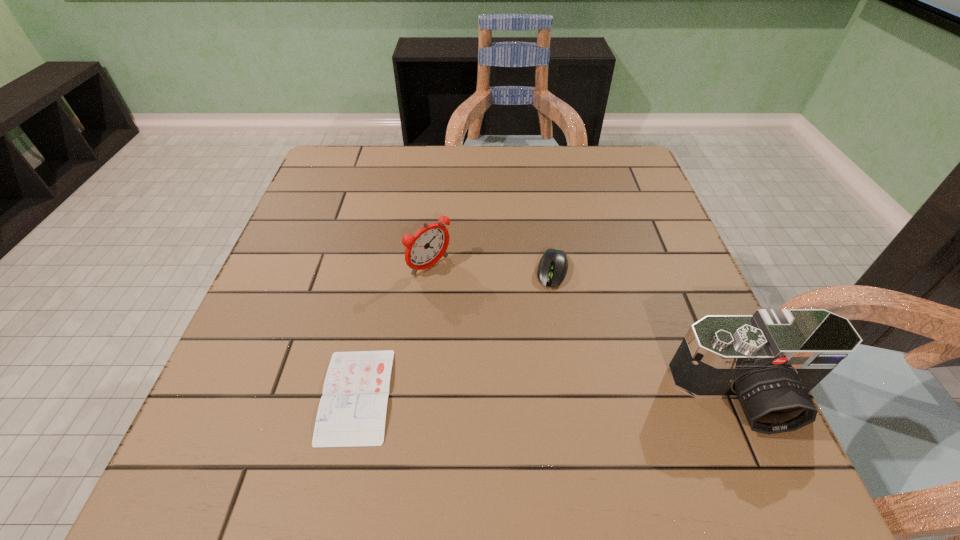
Image resolution: width=960 pixels, height=540 pixels. What are the coordinates of `diary` in the screenshot? It's located at (352, 411).

You are a GUI agent. You are given a task and a screenshot of the screen. Output one action in this format:
    pyautogui.click(x=<x>, y=<y>)
    Task: Click on the rightmost object
    The height and width of the screenshot is (540, 960).
    Given the screenshot: What is the action you would take?
    pyautogui.click(x=771, y=360)

This screenshot has height=540, width=960. In order to click on the tallest object in this screenshot , I will do `click(771, 360)`.

Identify the location of alarm clock. The image size is (960, 540). (428, 245).

Where is `the third object from left to right`? The width and height of the screenshot is (960, 540). the third object from left to right is located at coordinates (553, 266).

Where is `computer mouse`? The image size is (960, 540). computer mouse is located at coordinates (553, 266).

Where is `free space located on the right of the shortest object`? The image size is (960, 540). free space located on the right of the shortest object is located at coordinates (484, 395).

Where is `vacant point located on the front-facing side of the second tallest object`? The width and height of the screenshot is (960, 540). vacant point located on the front-facing side of the second tallest object is located at coordinates (487, 315).

Identify the location of free space located on the front-facing side of the second tallest object. (522, 346).

Where is `vacant point located 0.290m on the front-facing side of the second tallest object`? The height and width of the screenshot is (540, 960). vacant point located 0.290m on the front-facing side of the second tallest object is located at coordinates (541, 363).